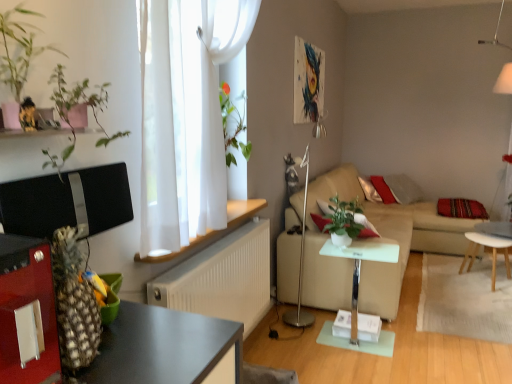
Where is `blank space above white textured radiator at center (from a real-world perspective)`? blank space above white textured radiator at center (from a real-world perspective) is located at coordinates (233, 235).